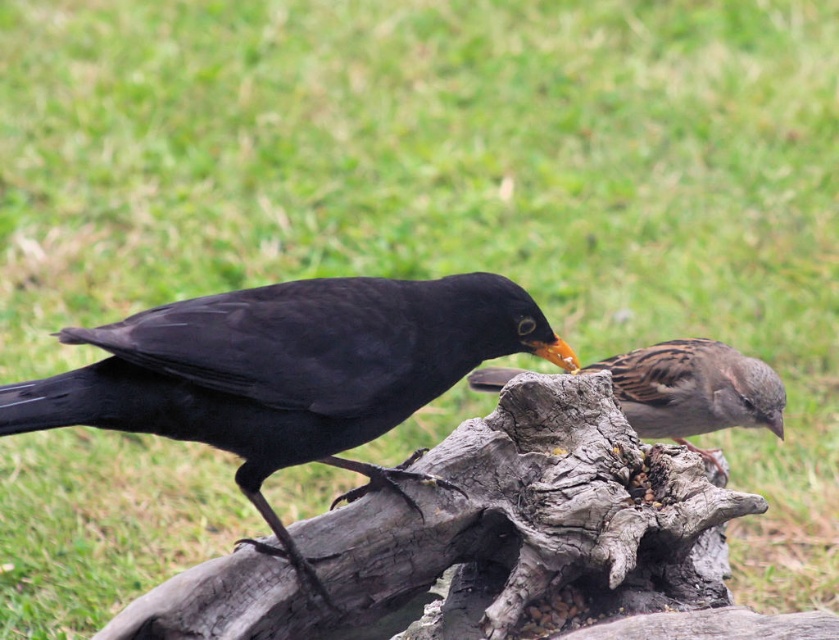
Does brown speckled sparrow at right appear on the left side of brown speckled feathers at center?

Correct, you'll find brown speckled sparrow at right to the left of brown speckled feathers at center.

You are a GUI agent. You are given a task and a screenshot of the screen. Output one action in this format:
    pyautogui.click(x=<x>, y=<y>)
    Task: Click on the brown speckled sparrow at right
    The height and width of the screenshot is (640, 839).
    Given the screenshot: What is the action you would take?
    click(x=289, y=374)